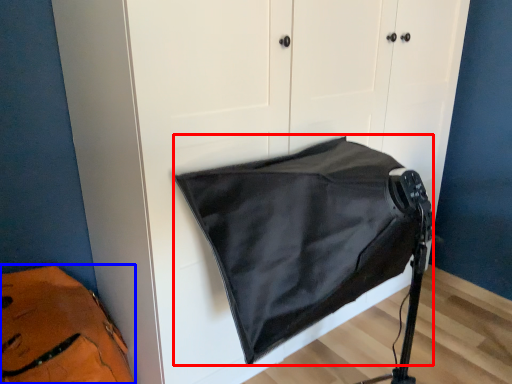
Question: Which object is closer to the camera taking this photo, sleeping bag (highlighted by a red box) or messenger bag (highlighted by a blue box)?

Choices:
 (A) sleeping bag
 (B) messenger bag

Answer: (A)